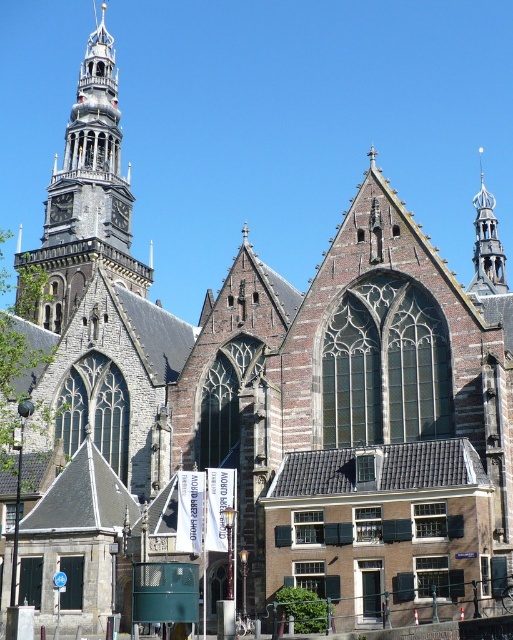
You are standing in front of the historic church and notice a specific point marked at coordinates point (88, 195). Based on the scene description, what architectural feature does this point most likely correspond to?

The point (88, 195) corresponds to the brown stone tower at upper left.

You are a drone operator trying to capture a photo of the historic church. The drone is currently positioned at the center of the image. To ensure the brown stone tower at upper left is included in the photo, in which direction should you adjust the drone? Please specify the direction based on the image coordinates provided.

The brown stone tower at upper left is located at point coordinates, so you should adjust the drone to the left and upward to include it in the photo.